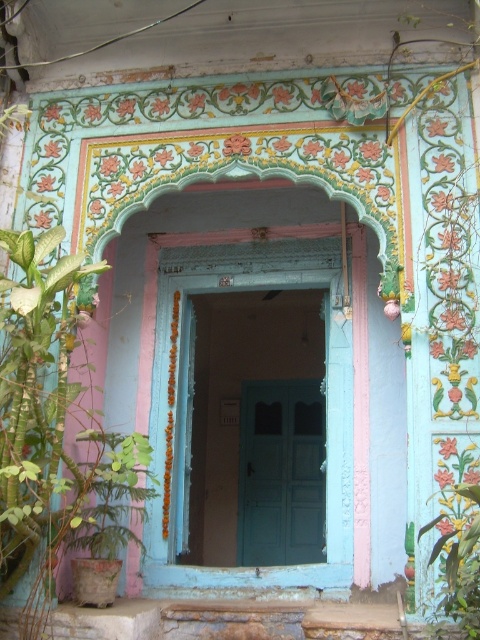
You are standing outside the entrance and want to enter the building. The teal painted door at center is the entrance. However, you are carrying a large green leafy plant at lower right. Can you fit through the doorway without bending the plant?

The teal painted door at center has a greater height compared to green leafy plant at lower right, so the plant should fit through the doorway without needing to be bent.

You are trying to decide which door to go through. The teal painted door at center and the teal matte door at center are both in front of you. Which one is wider?

The teal painted door at center is wider than the teal matte door at center according to the description.

You are a delivery person carrying a package that requires a 8 feet wide space to maneuver. You see the teal painted door at center and the teal matte door at center. Is there enough space between them to move through with your package?

The distance between the teal painted door at center and the teal matte door at center is 7.91 feet, which is slightly less than the required 8 feet. Therefore, there isn not enough space to maneuver the package between them.